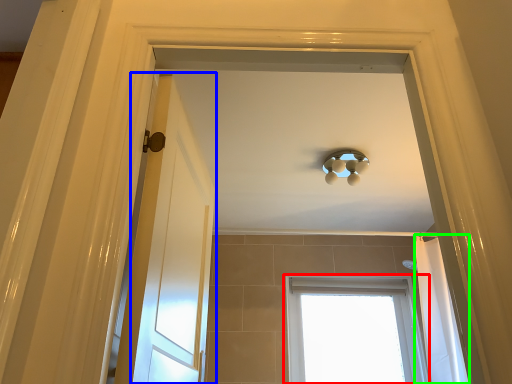
Question: Estimate the real-world distances between objects in this image. Which object is farther from window (highlighted by a red box), door (highlighted by a blue box) or shower curtain (highlighted by a green box)?

Choices:
 (A) door
 (B) shower curtain

Answer: (A)